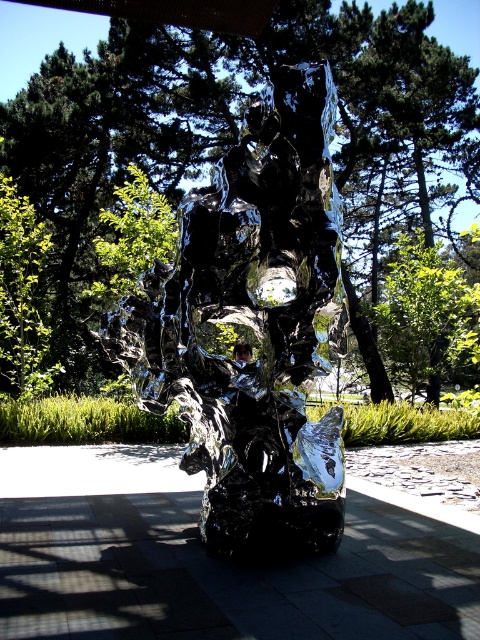
Does shiny metallic sculpture at center have a greater width compared to green leafy tree at center?

→ No, shiny metallic sculpture at center is not wider than green leafy tree at center.

Image resolution: width=480 pixels, height=640 pixels. Describe the element at coordinates (253, 326) in the screenshot. I see `shiny metallic sculpture at center` at that location.

The height and width of the screenshot is (640, 480). In order to click on shiny metallic sculpture at center in this screenshot , I will do `click(253, 326)`.

Can you confirm if glossy metallic tree at center is smaller than shiny metallic sculpture at center?

No.

Does point (48, 58) come in front of point (173, 268)?

That is False.

Identify the location of glossy metallic tree at center. The height and width of the screenshot is (640, 480). (239, 138).

Does glossy metallic tree at center have a greater height compared to green leafy tree at center?

Yes.

Is point (126, 93) positioned in front of point (418, 349)?

No, (126, 93) is further to viewer.

Locate an element on the screen. glossy metallic tree at center is located at coordinates (239, 138).